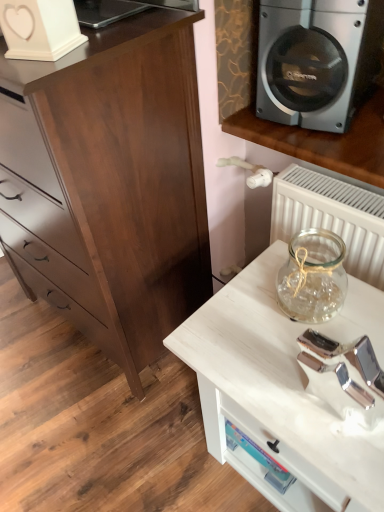
Question: Relative to silver metallic speaker at upper right, is white matte heart-shaped object at upper left in front or behind?

Choices:
 (A) front
 (B) behind

Answer: (A)

Question: Would you say white matte heart-shaped object at upper left is inside or outside silver metallic speaker at upper right?

Choices:
 (A) inside
 (B) outside

Answer: (B)

Question: Considering the real-world distances, which object is closest to the silver metallic speaker at upper right?

Choices:
 (A) white wood table at lower right
 (B) dark wood chest of drawers at left
 (C) white matte heart-shaped object at upper left

Answer: (B)

Question: Which object is the farthest from the dark wood chest of drawers at left?

Choices:
 (A) silver metallic speaker at upper right
 (B) white matte heart-shaped object at upper left
 (C) white wood table at lower right

Answer: (C)